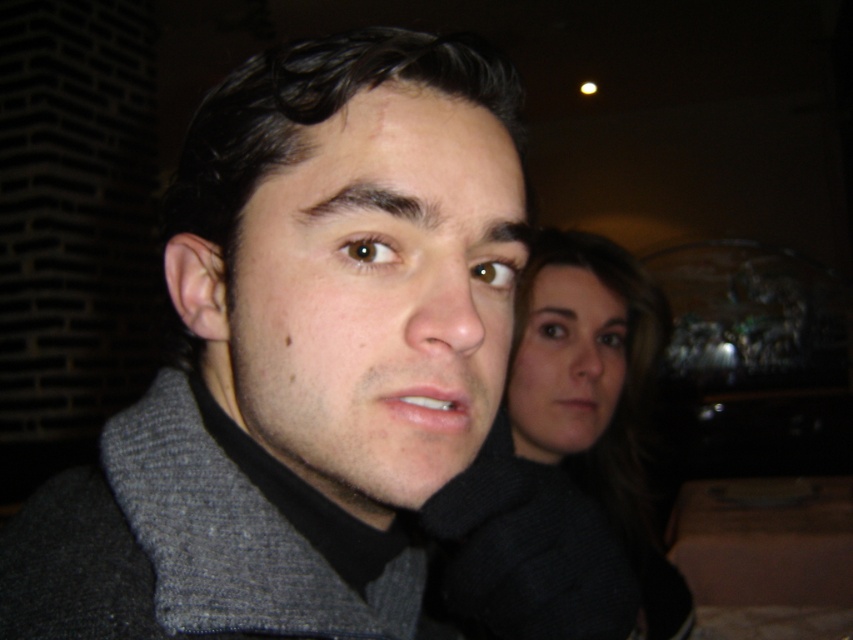
Question: Does gray fleece jacket at center come in front of black woolen sweater at center?

Choices:
 (A) yes
 (B) no

Answer: (A)

Question: Which point is farther from the camera taking this photo?

Choices:
 (A) (637, 554)
 (B) (468, 308)

Answer: (A)

Question: Does gray fleece jacket at center have a larger size compared to black woolen sweater at center?

Choices:
 (A) yes
 (B) no

Answer: (B)

Question: Which of the following is the farthest from the observer?

Choices:
 (A) black woolen sweater at center
 (B) gray fleece jacket at center

Answer: (A)

Question: Where is gray fleece jacket at center located in relation to black woolen sweater at center in the image?

Choices:
 (A) left
 (B) right

Answer: (A)

Question: Which object is farther from the camera taking this photo?

Choices:
 (A) gray fleece jacket at center
 (B) black woolen sweater at center

Answer: (B)